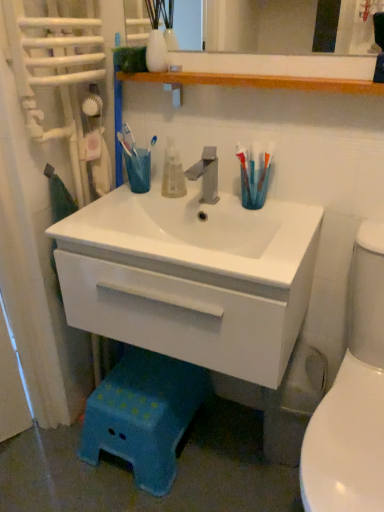
Question: Does satin nickel faucet at center come behind translucent plastic toothbrush at right?

Choices:
 (A) yes
 (B) no

Answer: (B)

Question: Is satin nickel faucet at center oriented away from translucent plastic toothbrush at right?

Choices:
 (A) yes
 (B) no

Answer: (B)

Question: Can you confirm if satin nickel faucet at center is taller than translucent plastic toothbrush at right?

Choices:
 (A) no
 (B) yes

Answer: (A)

Question: Does satin nickel faucet at center have a greater width compared to translucent plastic toothbrush at right?

Choices:
 (A) yes
 (B) no

Answer: (A)

Question: Is satin nickel faucet at center at the left side of translucent plastic toothbrush at right?

Choices:
 (A) yes
 (B) no

Answer: (A)

Question: Is satin nickel faucet at center thinner than translucent plastic toothbrush at right?

Choices:
 (A) yes
 (B) no

Answer: (B)

Question: Does blue plastic step stool at lower center have a greater width compared to white glossy cabinet at center?

Choices:
 (A) yes
 (B) no

Answer: (B)

Question: From a real-world perspective, is blue plastic step stool at lower center on top of white glossy cabinet at center?

Choices:
 (A) yes
 (B) no

Answer: (B)

Question: Would you say blue plastic step stool at lower center is outside white glossy cabinet at center?

Choices:
 (A) no
 (B) yes

Answer: (B)

Question: Is blue plastic step stool at lower center surrounding white glossy cabinet at center?

Choices:
 (A) no
 (B) yes

Answer: (A)

Question: Does blue plastic step stool at lower center have a greater height compared to white glossy cabinet at center?

Choices:
 (A) yes
 (B) no

Answer: (B)

Question: Considering the relative positions of blue plastic step stool at lower center and white glossy cabinet at center in the image provided, is blue plastic step stool at lower center to the right of white glossy cabinet at center from the viewer's perspective?

Choices:
 (A) yes
 (B) no

Answer: (B)

Question: Is translucent plastic toothbrush at right shorter than translucent plastic mouthwash at center?

Choices:
 (A) yes
 (B) no

Answer: (B)